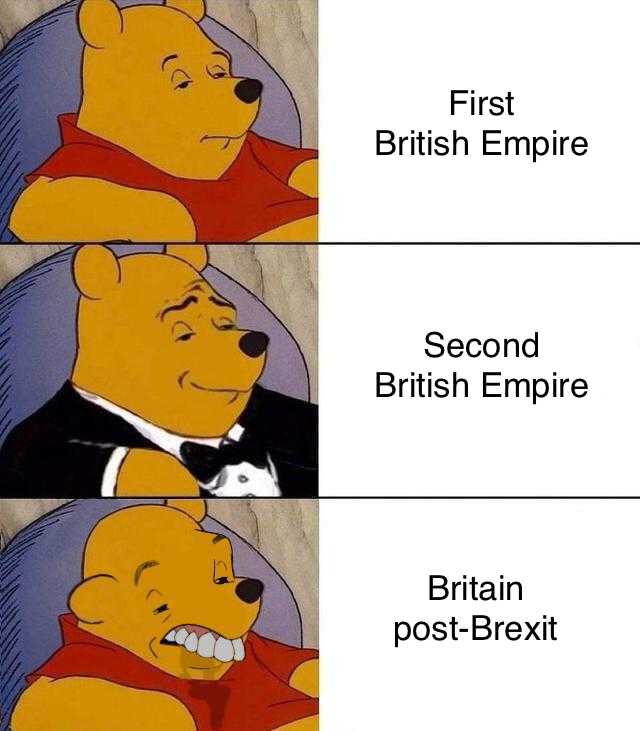
Locate an element on the screen. This screenshot has width=640, height=731. chair is located at coordinates (27, 602).